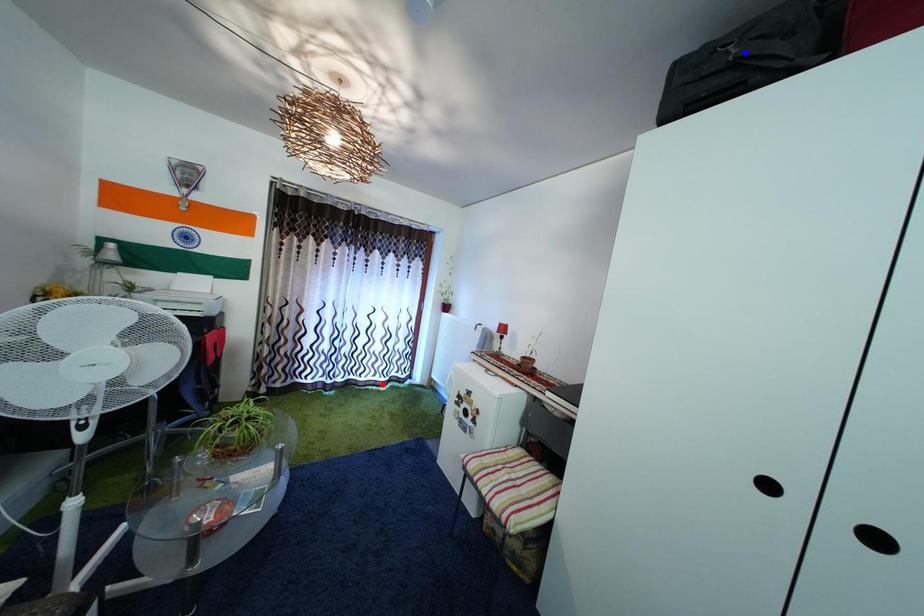
Question: Two points are marked on the image. Which point is closer to the camera?

Choices:
 (A) Blue point is closer.
 (B) Red point is closer.

Answer: (A)